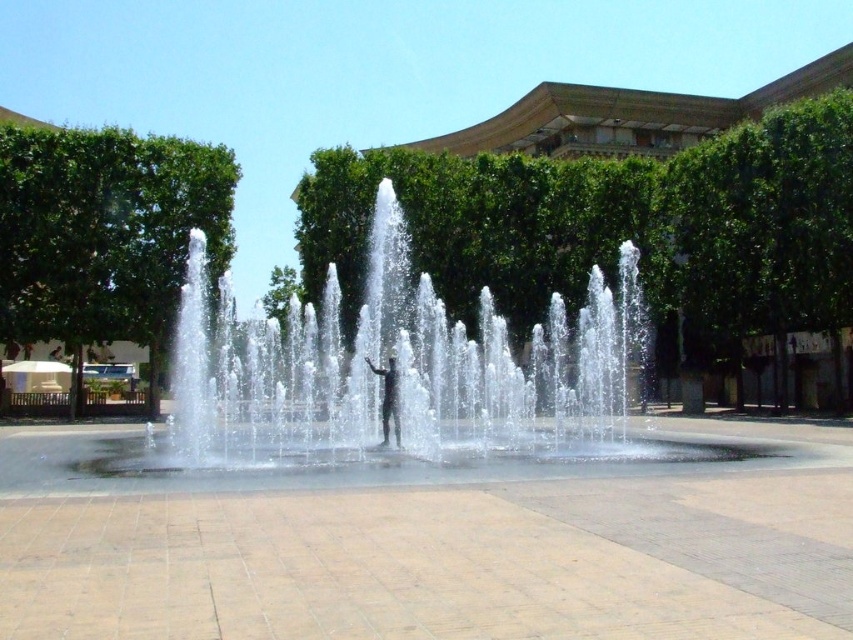
Is clear water at center thinner than black matte person at center?

No, clear water at center is not thinner than black matte person at center.

Does clear water at center appear under black matte person at center?

No, clear water at center is not below black matte person at center.

Is point (437, 353) positioned behind point (378, 371)?

Yes, it is.

You are a GUI agent. You are given a task and a screenshot of the screen. Output one action in this format:
    pyautogui.click(x=<x>, y=<y>)
    Task: Click on the clear water at center
    The width and height of the screenshot is (853, 640).
    Given the screenshot: What is the action you would take?
    pyautogui.click(x=386, y=365)